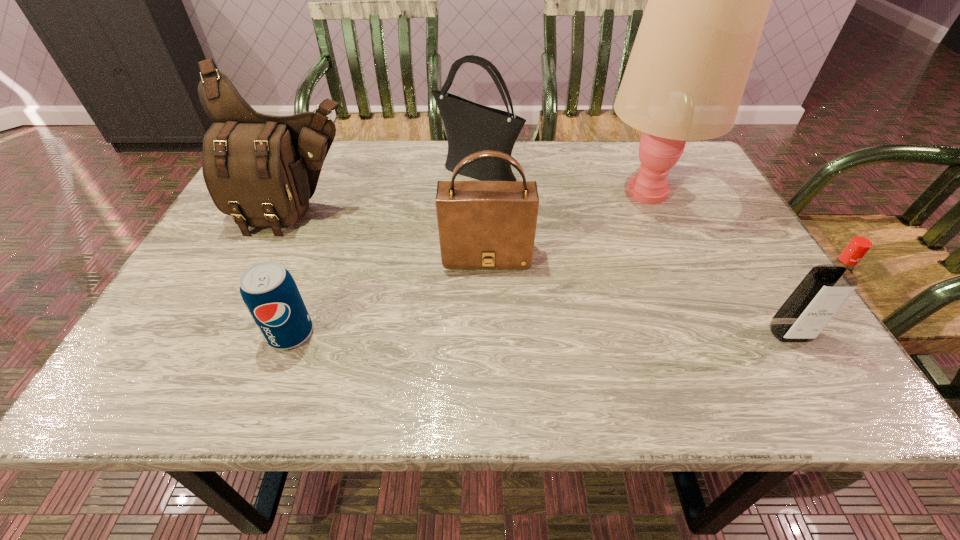
This screenshot has width=960, height=540. What are the coordinates of `object that can be found as the fourth closest to the farthest shoulder bag` in the screenshot? It's located at (268, 290).

You are a GUI agent. You are given a task and a screenshot of the screen. Output one action in this format:
    pyautogui.click(x=<x>, y=<y>)
    Task: Click on the shoulder bag that can be found as the closest to the vodka
    The width and height of the screenshot is (960, 540).
    Given the screenshot: What is the action you would take?
    pyautogui.click(x=482, y=224)

Identify which shoulder bag is the second nearest to the shortest object. Please provide its 2D coordinates. Your answer should be formatted as a tuple, i.e. [(x, y)], where the tuple contains the x and y coordinates of a point satisfying the conditions above.

[(482, 224)]

Identify the location of free location that satisfies the following two spatial constraints: 1. on the back side of the farthest shoulder bag; 2. on the left side of the shortest object. (350, 171).